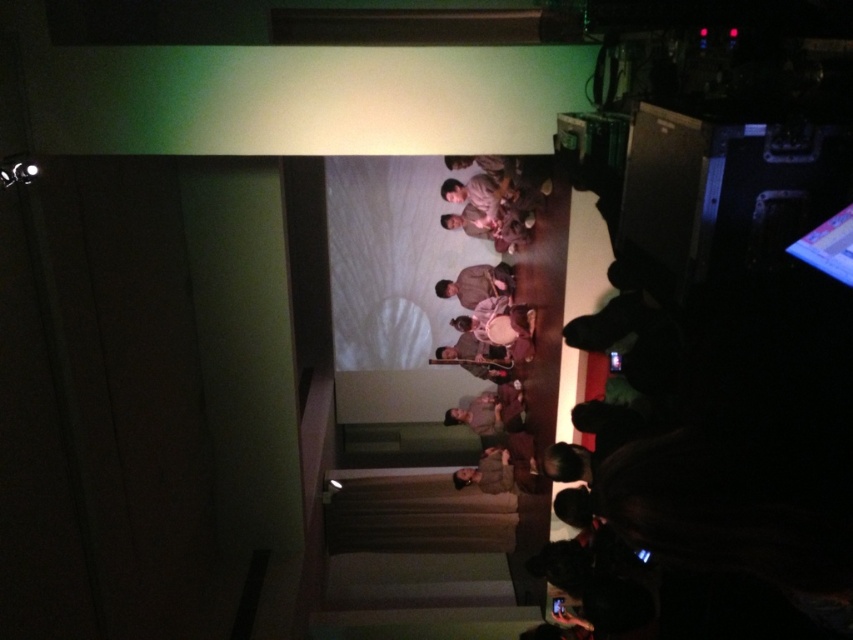
You are a photographer positioned at the camera. You want to capture a closeup of the brown fabric at center. The camera has a minimum focusing distance of 1.5 meters. Can you take the photo without moving closer?

The brown fabric at center is 6.77 meters from camera, which is beyond the camera minimum focusing distance of 1.5 meters. So yes, you can take the photo without moving closer.

You are an event photographer trying to capture the main performer on stage. You notice two brown fabrics in the scene. The first is labeled as brown fabric at center, and the second is brown fabric shirt at center. Which of these two brown fabrics is positioned higher up in the image?

The brown fabric at center is taller than the brown fabric shirt at center, so the brown fabric at center is positioned higher up in the image.